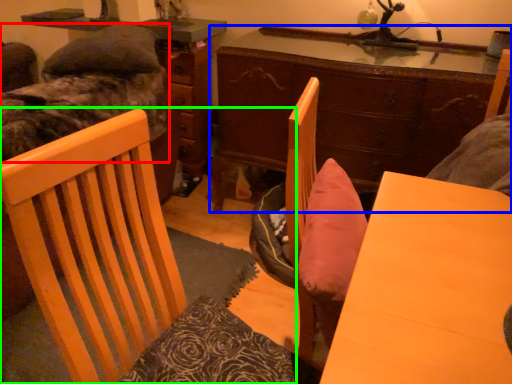
Question: Which object is the closest to the bed (highlighted by a red box)? Choose among these: desk (highlighted by a blue box) or chair (highlighted by a green box).

Choices:
 (A) desk
 (B) chair

Answer: (A)